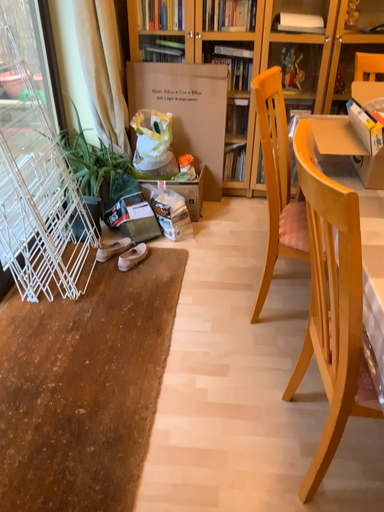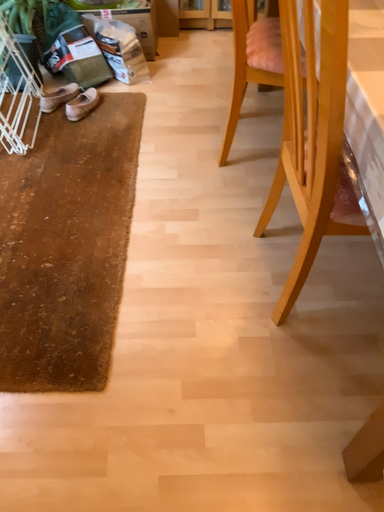
Question: Which way did the camera rotate in the video?

Choices:
 (A) rotated upward
 (B) rotated downward

Answer: (B)